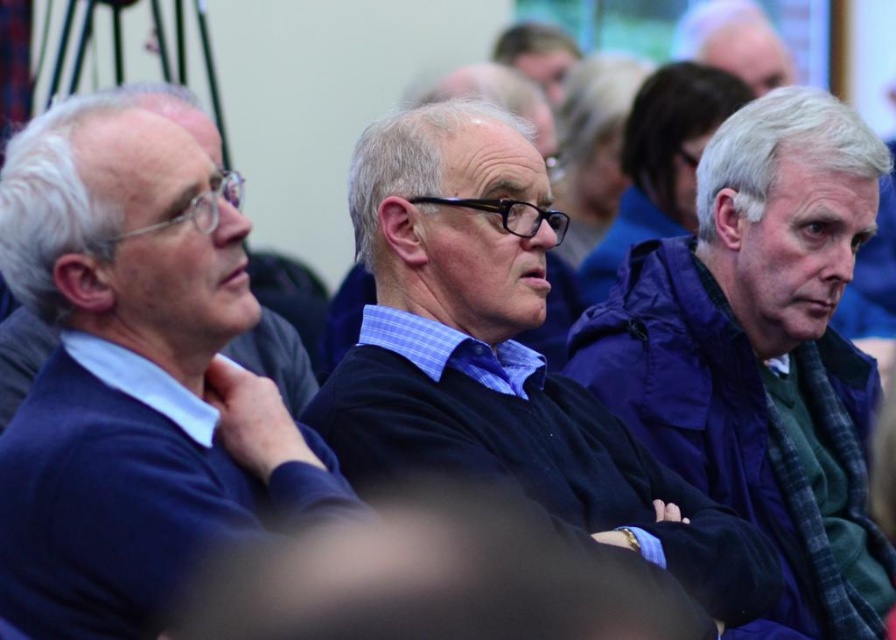
Question: Is black matte sweater at center below smooth skin face at upper center?

Choices:
 (A) no
 (B) yes

Answer: (B)

Question: Does black matte sweater at center lie in front of dark blue sweater at center?

Choices:
 (A) yes
 (B) no

Answer: (A)

Question: Which point appears farthest from the camera in this image?

Choices:
 (A) (636, 182)
 (B) (543, 44)

Answer: (B)

Question: Which object is positioned closest to the dark blue sweater at left?

Choices:
 (A) dark blue sweater at center
 (B) purple fabric jacket at right
 (C) smooth skin face at upper center

Answer: (B)

Question: Which point appears farthest from the camera in this image?

Choices:
 (A) (755, 92)
 (B) (781, 236)
 (C) (698, 77)

Answer: (A)

Question: Observing the image, what is the correct spatial positioning of dark blue sweater at left in reference to dark blue sweater at center?

Choices:
 (A) below
 (B) above

Answer: (A)